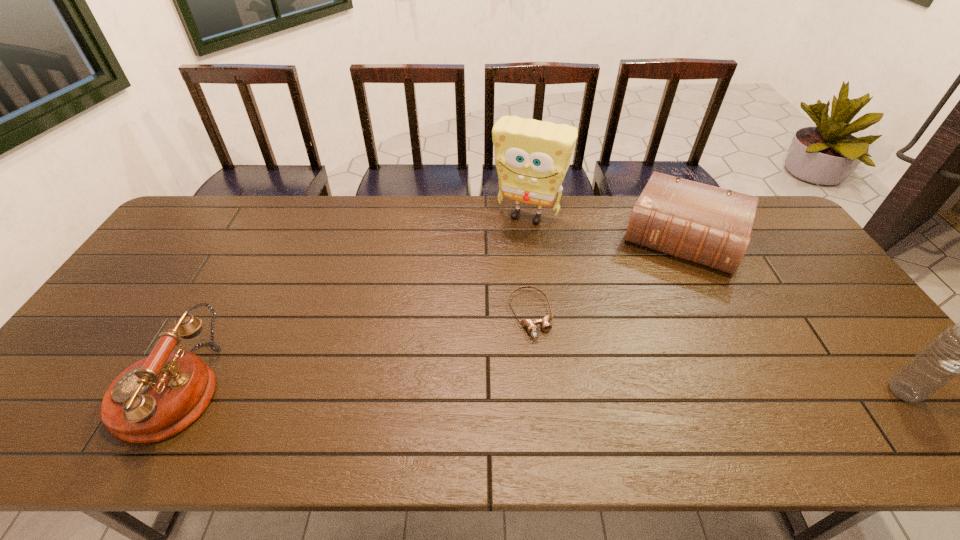
Image resolution: width=960 pixels, height=540 pixels. Find the location of `vacant space positioned 0.170m on the dial of the telephone`. vacant space positioned 0.170m on the dial of the telephone is located at coordinates (x=54, y=390).

Locate an element on the screen. vacant area situated on the left of the second tallest object is located at coordinates (753, 392).

This screenshot has height=540, width=960. I want to click on free space located on the front lenses and sides of the shortest object, so click(x=554, y=380).

The width and height of the screenshot is (960, 540). Find the location of `vacant space located 0.100m on the front lenses and sides of the shortest object`. vacant space located 0.100m on the front lenses and sides of the shortest object is located at coordinates (551, 373).

You are a GUI agent. You are given a task and a screenshot of the screen. Output one action in this format:
    pyautogui.click(x=<x>, y=<y>)
    Task: Click on the vacant space located on the spine side of the Bible
    
    Given the screenshot: What is the action you would take?
    pyautogui.click(x=629, y=376)

The height and width of the screenshot is (540, 960). What are the coordinates of `vacant area located 0.260m on the spine side of the Bible` in the screenshot? It's located at (644, 336).

The image size is (960, 540). Identify the location of free space located 0.090m on the spine side of the Bible. (660, 294).

Where is `free space located on the face of the sponge`? This screenshot has height=540, width=960. free space located on the face of the sponge is located at coordinates (497, 266).

I want to click on vacant area situated on the face of the sponge, so click(478, 302).

What are the coordinates of `vacant space located 0.130m on the face of the sponge` in the screenshot? It's located at (503, 255).